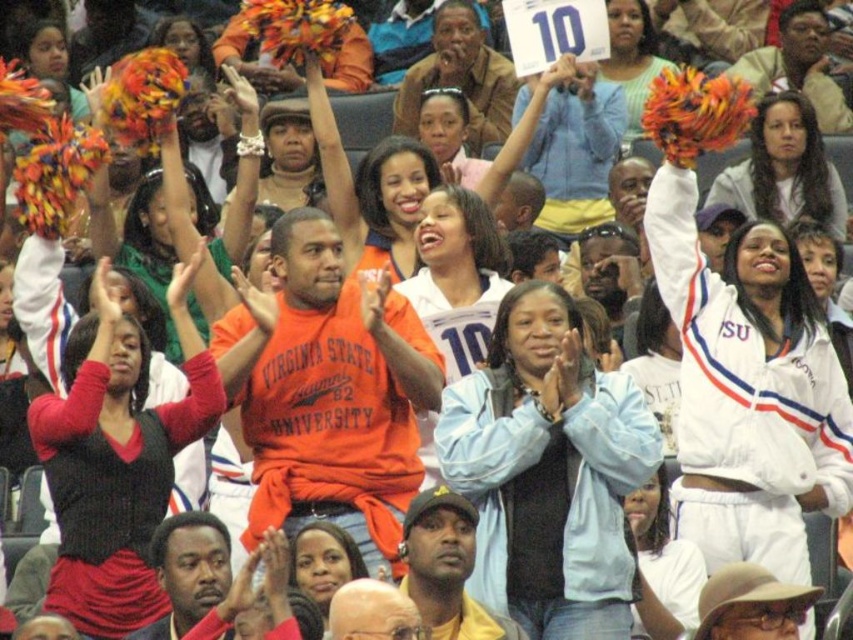
Question: Does orange jersey at center appear over light blue jersey at center?

Choices:
 (A) yes
 (B) no

Answer: (B)

Question: Does light blue jacket at center appear under light blue jersey at center?

Choices:
 (A) yes
 (B) no

Answer: (A)

Question: Can you confirm if light blue jacket at center is wider than orange jersey at center?

Choices:
 (A) yes
 (B) no

Answer: (A)

Question: Which point is closer to the camera taking this photo?

Choices:
 (A) (57, 44)
 (B) (612, 465)
 (C) (791, 160)

Answer: (B)

Question: Which point is closer to the camera taking this photo?

Choices:
 (A) (469, 387)
 (B) (106, 404)
 (C) (646, 6)
 (D) (39, 35)

Answer: (A)

Question: Which point is closer to the camera?

Choices:
 (A) knit sweater at center
 (B) white fleece jacket at upper right

Answer: (A)